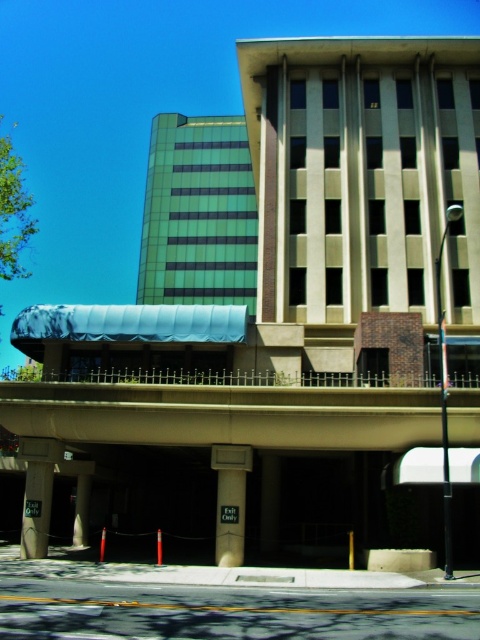
Is point (29, 548) more distant than point (73, 544)?

No, it is not.

Which of these two, concrete pillar at lower left or smooth concrete pillar at lower left, stands shorter?

Standing shorter between the two is concrete pillar at lower left.

Is point (51, 468) in front of point (84, 524)?

That is True.

Find the location of a particular element. The height and width of the screenshot is (640, 480). concrete pillar at lower left is located at coordinates (36, 509).

Does white glossy pillar at center have a lesser height compared to concrete pillar at lower left?

No.

Identify the location of white glossy pillar at center. This screenshot has width=480, height=640. (229, 500).

Between white glossy pillar at center and smooth concrete pillar at lower left, which one appears on the left side from the viewer's perspective?

smooth concrete pillar at lower left is more to the left.

Measure the distance between point (228, 472) and camera.

The distance of point (228, 472) from camera is 74.57 feet.

Find the location of a particular element. Image resolution: width=480 pixels, height=640 pixels. white glossy pillar at center is located at coordinates (229, 500).